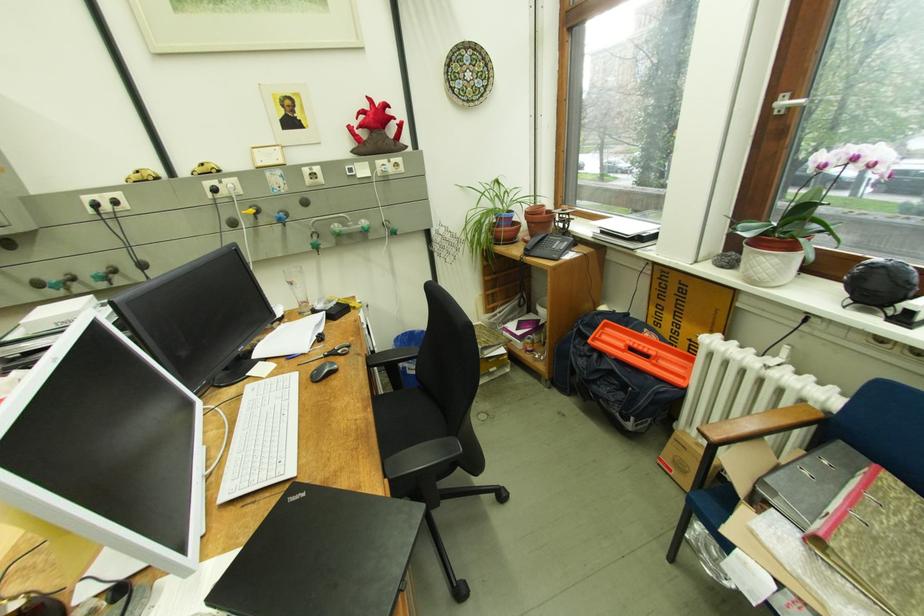
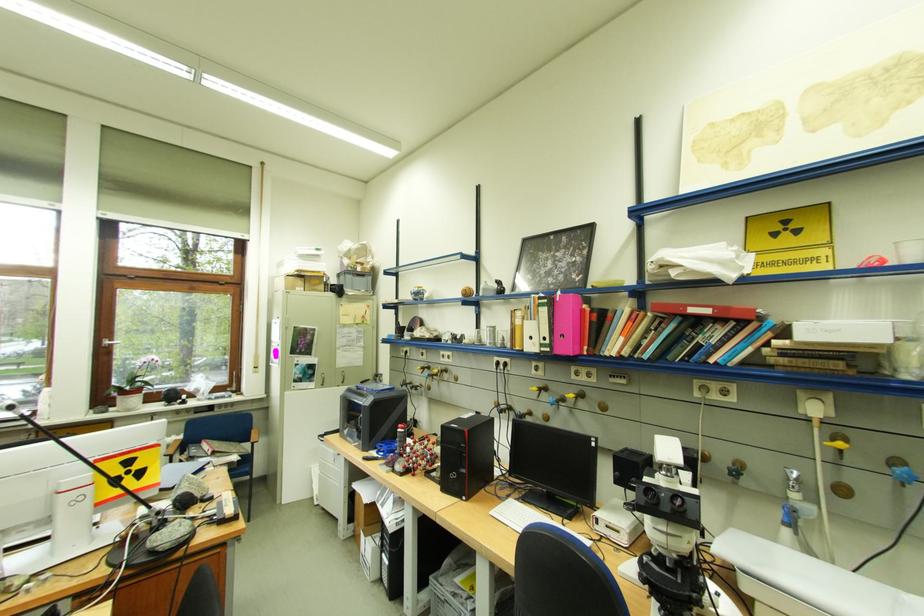
In the second image, find the point that corresponds to point 758,249 in the first image.

(130, 399)